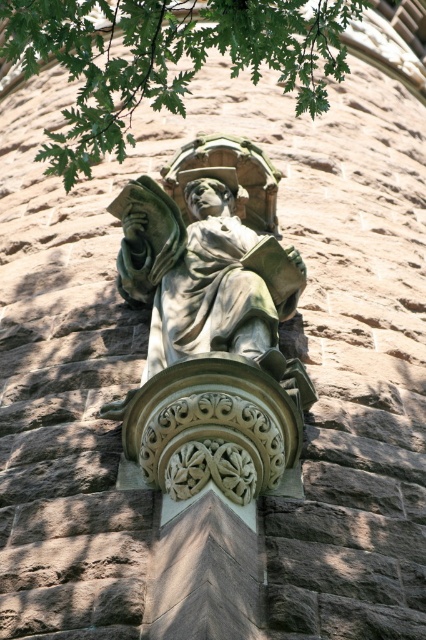
Does green stone statue at center have a lesser width compared to green leafy tree at upper center?

Correct, green stone statue at center's width is less than green leafy tree at upper center's.

What do you see at coordinates (210, 259) in the screenshot? This screenshot has width=426, height=640. I see `green stone statue at center` at bounding box center [210, 259].

Locate an element on the screen. green stone statue at center is located at coordinates (210, 259).

You are a GUI agent. You are given a task and a screenshot of the screen. Output one action in this format:
    pyautogui.click(x=<x>, y=<y>)
    Task: Click on the green stone statue at center
    This screenshot has width=426, height=640.
    Given the screenshot: What is the action you would take?
    pyautogui.click(x=210, y=259)